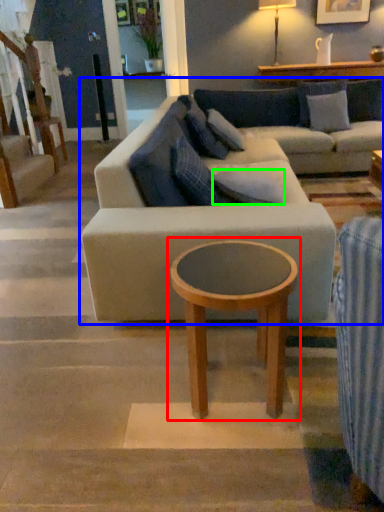
Question: Which object is positioned closest to coffee table (highlighted by a red box)? Select from studio couch (highlighted by a blue box) and pillow (highlighted by a green box).

Choices:
 (A) studio couch
 (B) pillow

Answer: (A)